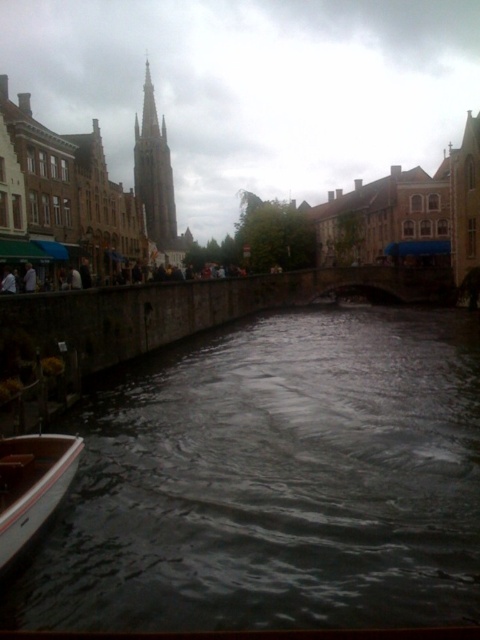
You are a tourist standing on the left bank of the canal. You see the dark gray water at lower center and the white wood boat at lower left. Which object is closer to you?

The dark gray water at lower center is closer to you because it is in front of the white wood boat at lower left.

You are a tourist standing on the left bank of the canal and want to take a photo of the dark gray water at lower center. Based on its 2D coordinates, where should you position your camera to capture the water in the frame?

The dark gray water at lower center is located at coordinates point (273,483), so you should position your camera to focus on that point to capture the water in the frame.

You are navigating a small boat along the canal and want to reach a specific point. From your current position, you see two points marked on the map as point 1 at coordinates [36,436] and point 2 at coordinates [137,144]. Which point is closer to you based on their positions in the scene?

Point 1 at coordinates [36,436] is closer to you because it is in front of point 2 at coordinates [137,144] in the scene.